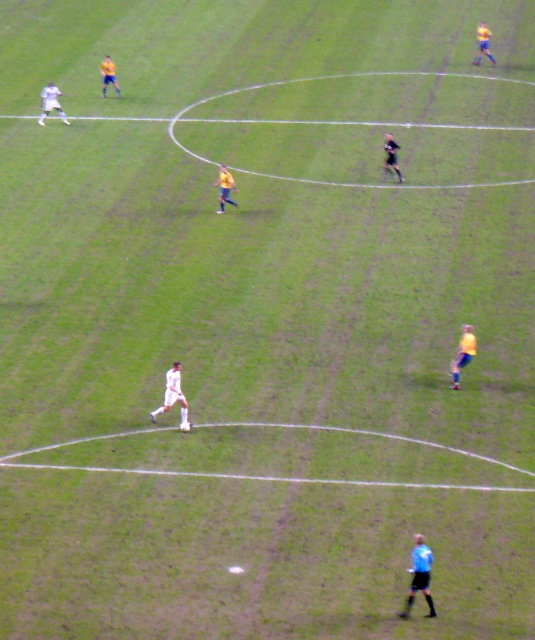
Does blue uniformed person at lower right appear under yellow matte jersey at right?

Indeed, blue uniformed person at lower right is positioned under yellow matte jersey at right.

Does blue uniformed person at lower right have a greater width compared to yellow matte jersey at right?

Correct, the width of blue uniformed person at lower right exceeds that of yellow matte jersey at right.

Which is in front, point (418, 541) or point (460, 346)?

Point (418, 541) is in front.

I want to click on blue uniformed person at lower right, so click(x=419, y=577).

Does white matte soccer player at center lie in front of white matte soccer player at upper left?

Yes, it is in front of white matte soccer player at upper left.

Is point (174, 380) positioned before point (52, 106)?

Yes, it is.

Identify the location of white matte soccer player at center. Image resolution: width=535 pixels, height=640 pixels. (172, 396).

Is white matte soccer player at center taller than yellow jersey at center?

No.

From the picture: Is white matte soccer player at center bigger than yellow jersey at center?

Correct, white matte soccer player at center is larger in size than yellow jersey at center.

The width and height of the screenshot is (535, 640). What do you see at coordinates (172, 396) in the screenshot? I see `white matte soccer player at center` at bounding box center [172, 396].

The image size is (535, 640). What are the coordinates of `white matte soccer player at center` in the screenshot? It's located at (172, 396).